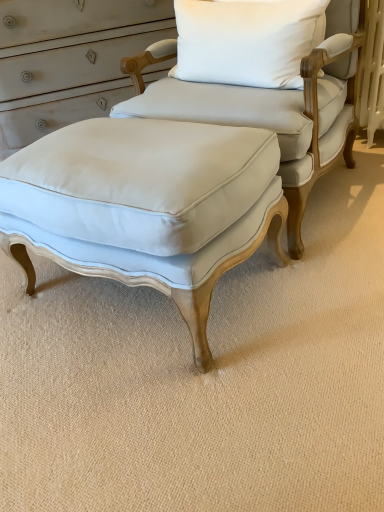
Find the location of `light blue fabric ottoman at center`. light blue fabric ottoman at center is located at coordinates (275, 106).

This screenshot has width=384, height=512. What do you see at coordinates (247, 40) in the screenshot?
I see `white cotton pillow at upper center` at bounding box center [247, 40].

Measure the distance between white cotton pillow at upper center and camera.

The depth of white cotton pillow at upper center is 1.29 meters.

Where is `light blue fabric ottoman at center`? light blue fabric ottoman at center is located at coordinates (275, 106).

From the image's perspective, which object appears higher, matte white fabric stool at center or white cotton pillow at upper center?

white cotton pillow at upper center is shown above in the image.

Is matte white fabric stool at center positioned with its back to white cotton pillow at upper center?

No, matte white fabric stool at center's orientation is not away from white cotton pillow at upper center.

The height and width of the screenshot is (512, 384). I want to click on stool located underneath the white cotton pillow at upper center (from a real-world perspective), so click(x=150, y=204).

Can you confirm if light blue fabric ottoman at center is positioned to the right of white cotton pillow at upper center?

Yes, light blue fabric ottoman at center is to the right of white cotton pillow at upper center.

What's the angular difference between light blue fabric ottoman at center and white cotton pillow at upper center's facing directions?

There is a 3.82-degree angle between the facing directions of light blue fabric ottoman at center and white cotton pillow at upper center.

Is light blue fabric ottoman at center taller or shorter than white cotton pillow at upper center?

Clearly, light blue fabric ottoman at center is taller compared to white cotton pillow at upper center.

Is light blue fabric ottoman at center oriented towards white cotton pillow at upper center?

Yes, light blue fabric ottoman at center is aimed at white cotton pillow at upper center.

Is matte white fabric stool at center positioned with its back to light blue fabric ottoman at center?

matte white fabric stool at center does not have its back to light blue fabric ottoman at center.

Is matte white fabric stool at center bigger than light blue fabric ottoman at center?

Actually, matte white fabric stool at center might be smaller than light blue fabric ottoman at center.

Consider the image. Can you confirm if matte white fabric stool at center is shorter than light blue fabric ottoman at center?

Indeed, matte white fabric stool at center has a lesser height compared to light blue fabric ottoman at center.

From a real-world perspective, which is physically below, matte white fabric stool at center or light blue fabric ottoman at center?

From a 3D spatial view, matte white fabric stool at center is below.

Which of these two, light blue fabric ottoman at center or matte white fabric stool at center, is thinner?

With smaller width is matte white fabric stool at center.

From a real-world perspective, is light blue fabric ottoman at center positioned above or below matte white fabric stool at center?

Clearly, from a real-world perspective, light blue fabric ottoman at center is above matte white fabric stool at center.

Is light blue fabric ottoman at center looking in the opposite direction of matte white fabric stool at center?

No, light blue fabric ottoman at center's orientation is not away from matte white fabric stool at center.

Would you say white cotton pillow at upper center is outside light blue fabric ottoman at center?

Actually, white cotton pillow at upper center is within light blue fabric ottoman at center.

In the scene shown: Is light blue fabric ottoman at center at the back of white cotton pillow at upper center?

Yes, white cotton pillow at upper center's orientation is away from light blue fabric ottoman at center.

Between point (184, 31) and point (130, 104), which one is positioned behind?

The point (184, 31) is farther.

Is white cotton pillow at upper center at the left side of light blue fabric ottoman at center?

Yes, white cotton pillow at upper center is to the left of light blue fabric ottoman at center.

Can you confirm if white cotton pillow at upper center is smaller than matte white fabric stool at center?

Indeed, white cotton pillow at upper center has a smaller size compared to matte white fabric stool at center.

Locate an element on the screen. Image resolution: width=384 pixels, height=512 pixels. stool lying on the left of white cotton pillow at upper center is located at coordinates (150, 204).

Considering their positions, is white cotton pillow at upper center located in front of or behind matte white fabric stool at center?

white cotton pillow at upper center is behind matte white fabric stool at center.

Which is more to the right, white cotton pillow at upper center or matte white fabric stool at center?

From the viewer's perspective, white cotton pillow at upper center appears more on the right side.

You are a GUI agent. You are given a task and a screenshot of the screen. Output one action in this format:
    pyautogui.click(x=<x>, y=<y>)
    Task: Click on the pillow above the matte white fabric stool at center (from a real-world perspective)
    The width and height of the screenshot is (384, 512).
    Given the screenshot: What is the action you would take?
    pyautogui.click(x=247, y=40)

The image size is (384, 512). In order to click on chair that is below the white cotton pillow at upper center (from the image's perspective) in this screenshot , I will do click(275, 106).

Based on their spatial positions, is light blue fabric ottoman at center or matte white fabric stool at center closer to white cotton pillow at upper center?

light blue fabric ottoman at center lies closer to white cotton pillow at upper center than the other object.

Based on their spatial positions, is matte white fabric stool at center or light blue fabric ottoman at center further from white cotton pillow at upper center?

matte white fabric stool at center is positioned further to the anchor white cotton pillow at upper center.

From the image, which object appears to be farther from matte white fabric stool at center, white cotton pillow at upper center or light blue fabric ottoman at center?

white cotton pillow at upper center lies further to matte white fabric stool at center than the other object.

Which object lies nearer to the anchor point light blue fabric ottoman at center, matte white fabric stool at center or white cotton pillow at upper center?

The object closer to light blue fabric ottoman at center is white cotton pillow at upper center.

Considering their positions, is light blue fabric ottoman at center positioned closer to matte white fabric stool at center than white cotton pillow at upper center?

light blue fabric ottoman at center.

From the image, which object appears to be nearer to light blue fabric ottoman at center, white cotton pillow at upper center or matte white fabric stool at center?

Based on the image, white cotton pillow at upper center appears to be nearer to light blue fabric ottoman at center.

What are the coordinates of `chair that lies between white cotton pillow at upper center and matte white fabric stool at center from top to bottom` in the screenshot? It's located at (275, 106).